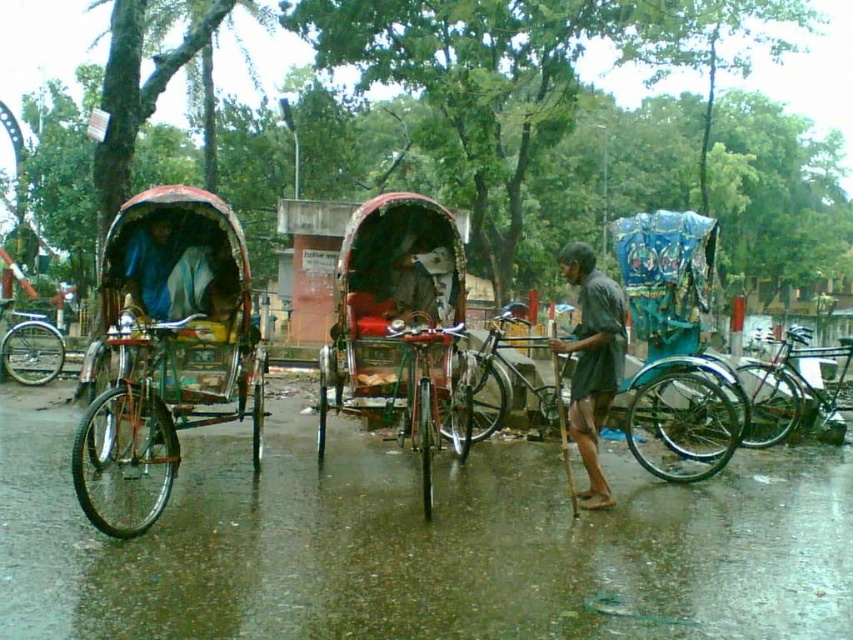
Question: Which of these objects is positioned farthest from the red fabric rickshaw at center?

Choices:
 (A) metallic red rickshaw at left
 (B) shiny metallic bicycle at right
 (C) dark gray fabric shirt at center
 (D) shiny metallic bicycle at center

Answer: (B)

Question: Can you confirm if orange metallic bicycle at left is bigger than shiny metallic bicycle at right?

Choices:
 (A) yes
 (B) no

Answer: (B)

Question: Does shiny metallic bicycle at center appear on the right side of metallic silver bicycle at center?

Choices:
 (A) no
 (B) yes

Answer: (A)

Question: Is dark gray fabric shirt at center thinner than silver metallic bicycle at left?

Choices:
 (A) no
 (B) yes

Answer: (A)

Question: Which object appears closest to the camera in this image?

Choices:
 (A) dark gray fabric shirt at center
 (B) metallic silver bicycle at center
 (C) shiny metallic bicycle at center
 (D) silver metallic bicycle at left

Answer: (C)

Question: Among these objects, which one is nearest to the camera?

Choices:
 (A) dark gray fabric shirt at center
 (B) shiny metallic bicycle at center
 (C) silver metallic bicycle at left
 (D) metallic silver bicycle at center

Answer: (B)